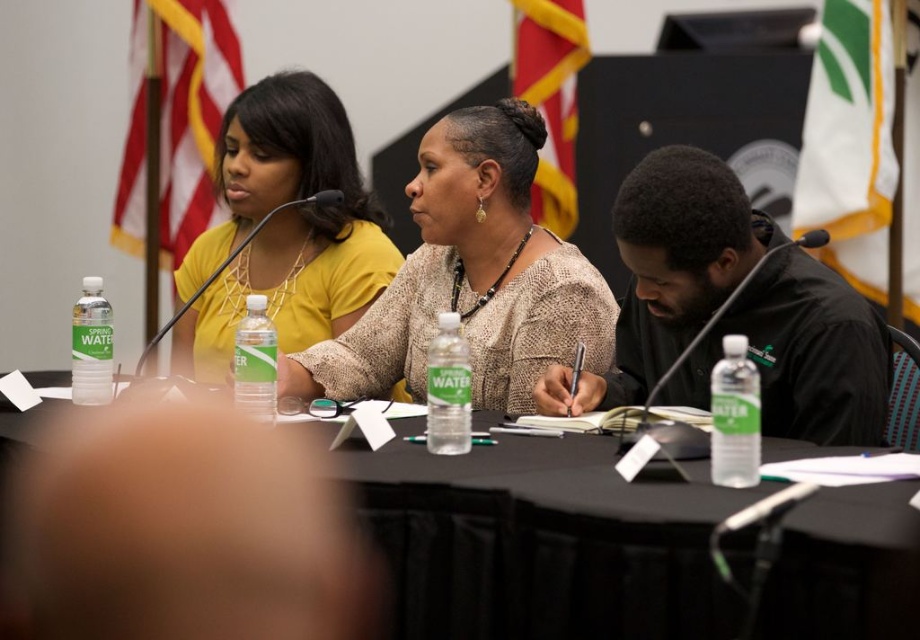
You are a photographer at the back of the room. You need to take a photo of the matte yellow shirt at upper left and the clear plastic water bottle at lower left. Which object should be placed higher in the photo to ensure both are visible?

The matte yellow shirt at upper left should be placed higher in the photo since it is above the clear plastic water bottle at lower left in the scene.

In the conference scene, you need to determine which object is wider between the matte yellow shirt at upper left and the clear plastic water bottle at lower left. Can you identify which one is wider?

The matte yellow shirt at upper left is wider than the clear plastic water bottle at lower left according to the description.